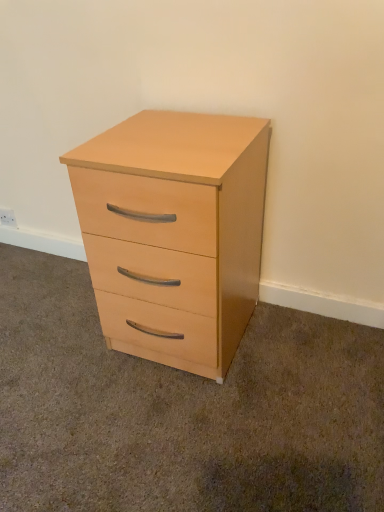
Where is `vacant space in front of light wood/finish chest of drawers at center`? The image size is (384, 512). vacant space in front of light wood/finish chest of drawers at center is located at coordinates (180, 430).